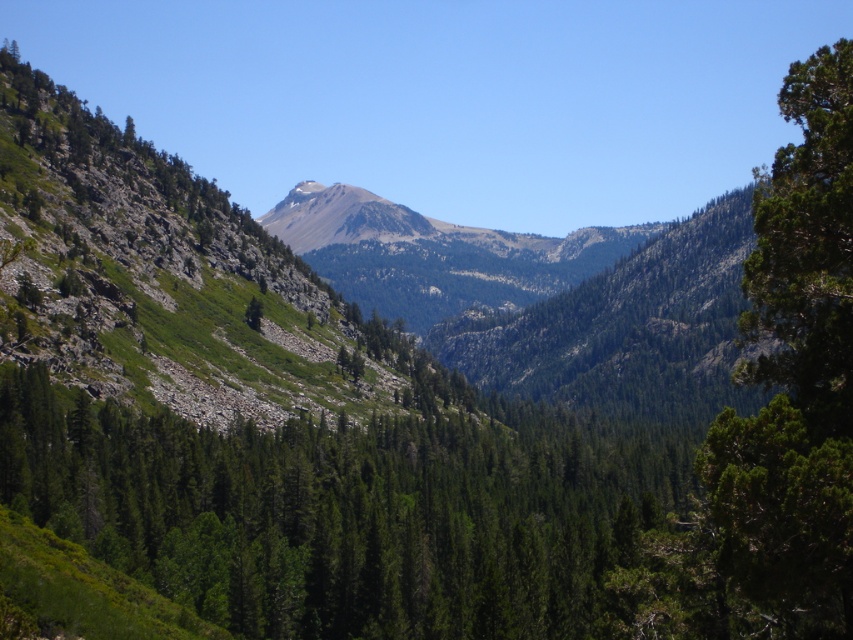
You are a hiker planning to take a photo of both the green matte tree at center and the green textured tree at right. Which tree should you stand closer to in order to capture both in the same frame without zooming?

You should stand closer to the green matte tree at center because it is shorter than the green textured tree at right, allowing both to fit within the frame when positioned appropriately.

You are a hiker standing at the starting point of the trail. You see two points marked on the map as point 1 at coordinates point (396, 490) and point 2 at coordinates point (769, 296). Which point is closer to your current position?

Point (396, 490) is closer to your current position because it is further to the viewer than point (769, 296).

You are hiking through the mountainous landscape and want to reach the green textured tree at right. Which direction should you move relative to the green matte tree at center to get there?

To reach the green textured tree at right from the green matte tree at center, you should move towards the right since the green textured tree at right is positioned to the right of the green matte tree at center.